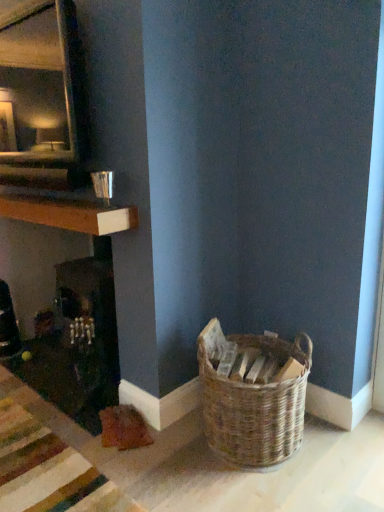
Image resolution: width=384 pixels, height=512 pixels. In order to click on spots to the right of woven brown basket at lower right in this screenshot , I will do tap(341, 456).